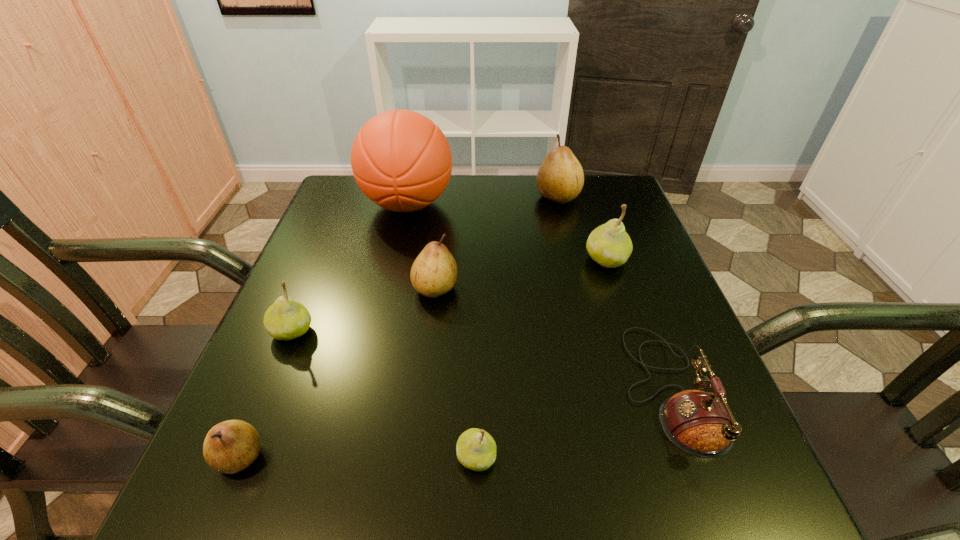
At what (x,y) coordinates should I click in order to perform the action: click on pink telephone. Please return your answer as a coordinate pair (x, y). Looking at the image, I should click on (700, 423).

This screenshot has width=960, height=540. In order to click on the leftmost brown pear in this screenshot , I will do `click(231, 446)`.

This screenshot has height=540, width=960. Identify the location of the nearest brown pear. (231, 446).

At what (x,y) coordinates should I click in order to perform the action: click on the nearest green pear. Please return your answer as a coordinate pair (x, y). This screenshot has height=540, width=960. Looking at the image, I should click on pos(476,449).

Image resolution: width=960 pixels, height=540 pixels. Find the location of `the third pear from right to left`. the third pear from right to left is located at coordinates pos(476,449).

Find the location of a particular element. The width and height of the screenshot is (960, 540). vacant space located on the right of the tallest object is located at coordinates (517, 204).

Locate an element on the screen. The width and height of the screenshot is (960, 540). vacant region located on the front of the rightmost brown pear is located at coordinates (575, 265).

Identify the location of free space located 0.290m on the front of the biggest green pear. (648, 387).

The image size is (960, 540). I want to click on vacant area situated 0.260m on the back of the second biggest brown pear, so click(x=444, y=207).

Find the location of a particular element. free spot located on the back of the leftmost green pear is located at coordinates (341, 214).